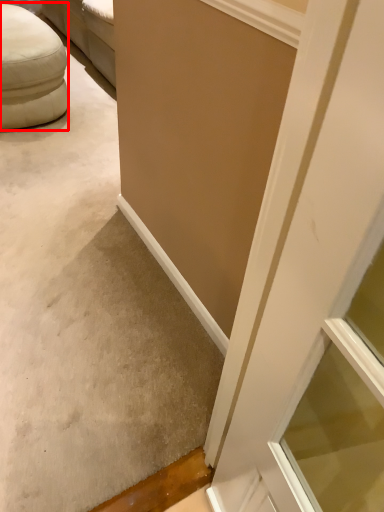
Question: Where is furniture (annotated by the red box) located in relation to concrete in the image?

Choices:
 (A) right
 (B) left

Answer: (B)